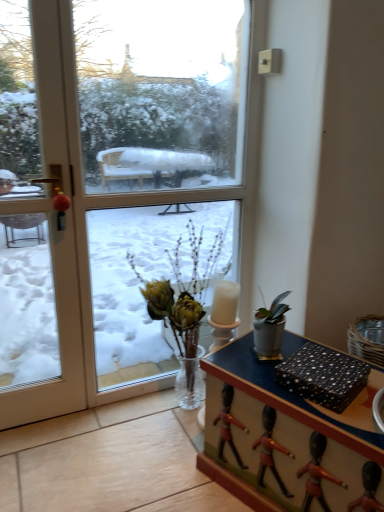
Locate an element on the screen. The width and height of the screenshot is (384, 512). free space in front of black dotted paper at lower right is located at coordinates point(344,420).